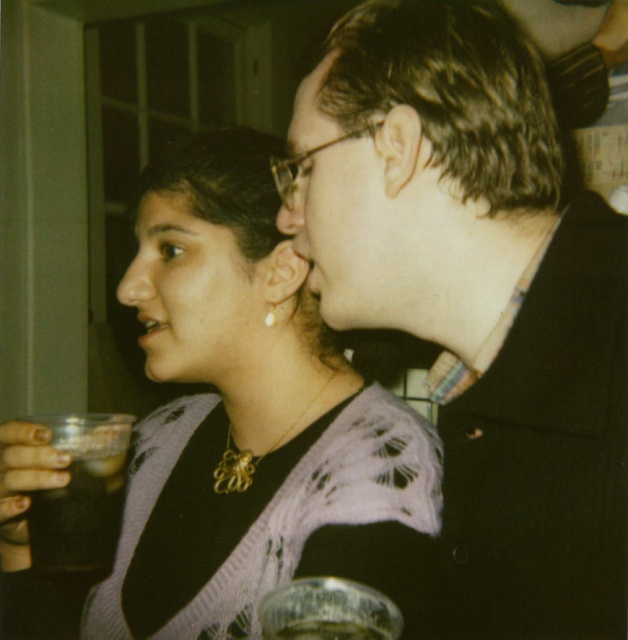
Can you confirm if matte black glasses at center is thinner than gold metallic earring at upper left?

No, matte black glasses at center is not thinner than gold metallic earring at upper left.

Who is positioned more to the right, matte black glasses at center or gold metallic earring at upper left?

From the viewer's perspective, matte black glasses at center appears more on the right side.

Image resolution: width=628 pixels, height=640 pixels. Find the location of `matte black glasses at center`. matte black glasses at center is located at coordinates (333, 205).

Where is `matte black glasses at center`? This screenshot has width=628, height=640. matte black glasses at center is located at coordinates (333, 205).

Can you confirm if transparent plastic wine glass at lower center is shorter than clear glass at lower center?

Incorrect, transparent plastic wine glass at lower center's height does not fall short of clear glass at lower center's.

Does point (274, 612) come behind point (332, 634)?

Yes, point (274, 612) is farther from viewer.

Which is in front, point (333, 616) or point (301, 637)?

Positioned in front is point (301, 637).

Where is `transparent plastic wine glass at lower center`? transparent plastic wine glass at lower center is located at coordinates (327, 611).

From the picture: Can you confirm if purple knitted sweater at upper left is shorter than clear glass at lower center?

No.

Which of these two, purple knitted sweater at upper left or clear glass at lower center, stands taller?

With more height is purple knitted sweater at upper left.

Which is behind, point (224, 230) or point (295, 628)?

Positioned behind is point (224, 230).

Locate an element on the screen. Image resolution: width=628 pixels, height=640 pixels. purple knitted sweater at upper left is located at coordinates (244, 413).